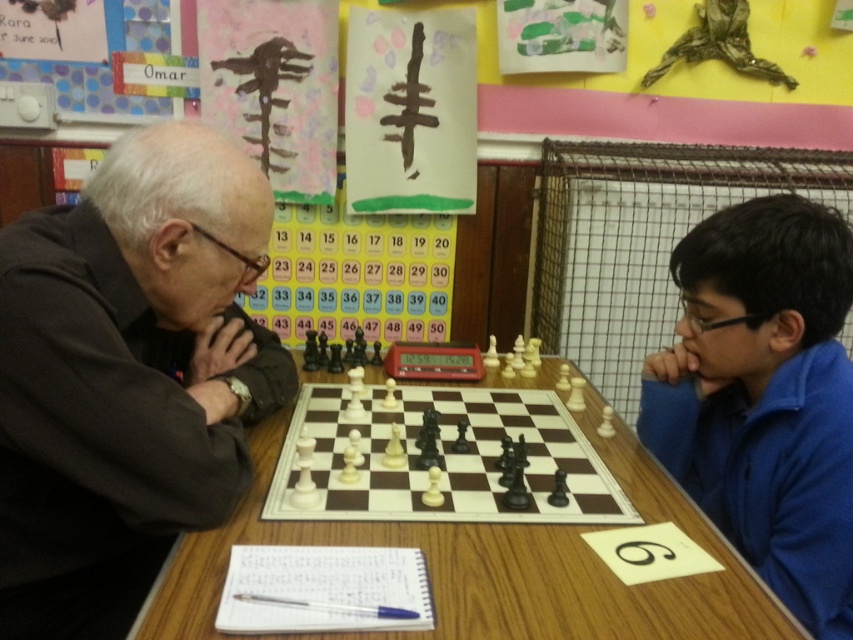
You are standing at the entrance of the classroom and want to join the chess game. Where should you go to find the wooden table at center?

The wooden table at center is located at the 2D coordinates point (498,564), so you should go to that point to find it.

You are a photographer standing in front of the wooden table at center where the chess game is happening. You want to place a tripod on the table to capture the game. Considering the dark brown leather jacket at left is also on the table, will there be enough space for the tripod?

The dark brown leather jacket at left is smaller than the wooden table at center, so there should be enough space on the wooden table at center to place the tripod alongside the jacket.